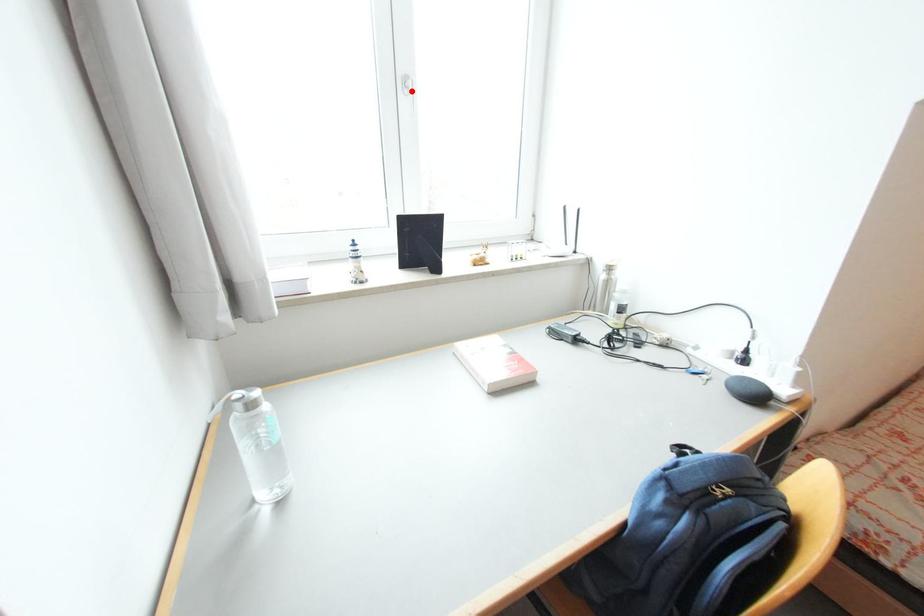
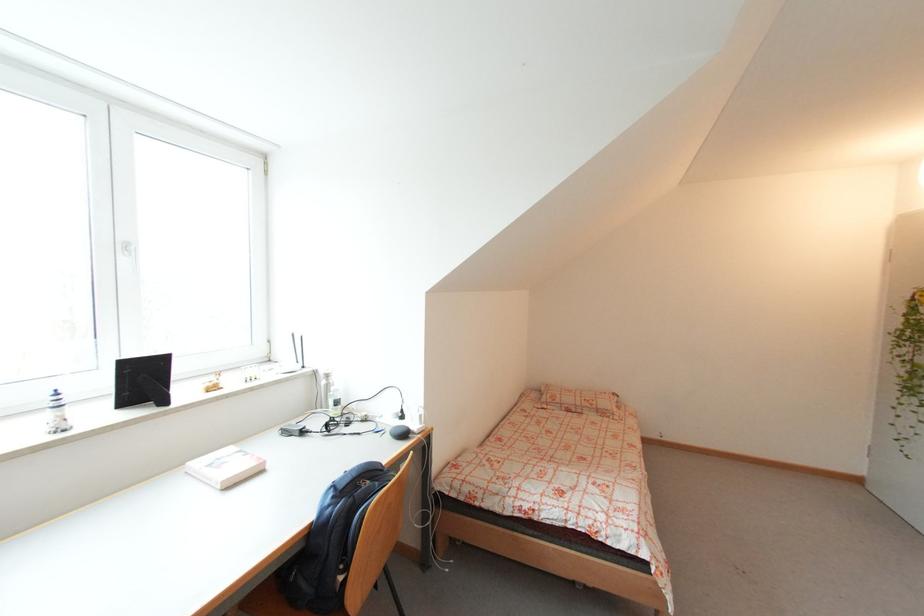
The point at the highlighted location is marked in the first image. Where is the corresponding point in the second image?

(130, 253)